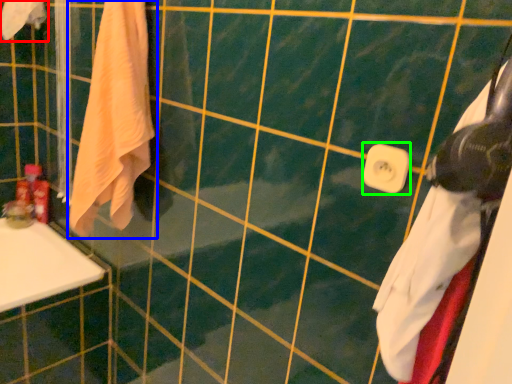
Question: Which object is positioned closest to towel (highlighted by a red box)? Select from towel (highlighted by a blue box) and towel bar (highlighted by a green box).

Choices:
 (A) towel
 (B) towel bar

Answer: (A)